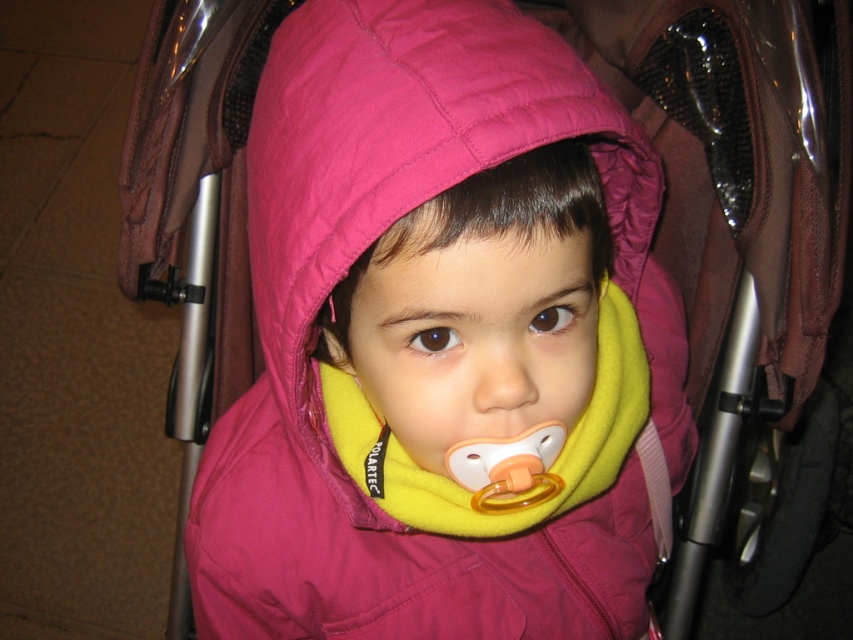
Who is taller, pink fleece jacket at center or yellow rubber teething ring at center?

pink fleece jacket at center is taller.

The image size is (853, 640). In order to click on pink fleece jacket at center in this screenshot , I will do `click(486, 348)`.